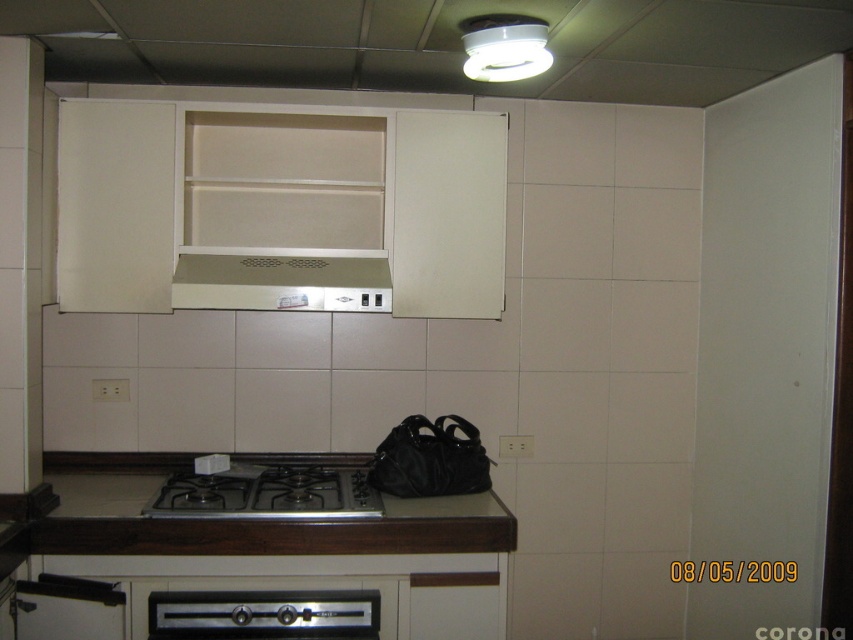
Question: Which object appears farthest from the camera in this image?

Choices:
 (A) satin beige exhaust hood at center
 (B) black matte gas stove at center
 (C) satin silver oven at lower center

Answer: (A)

Question: Does brown wood counter top at center appear over satin beige exhaust hood at center?

Choices:
 (A) yes
 (B) no

Answer: (B)

Question: Considering the real-world distances, which object is farthest from the brown wood counter top at center?

Choices:
 (A) satin beige exhaust hood at center
 (B) satin silver oven at lower center
 (C) black matte gas stove at center

Answer: (A)

Question: Estimate the real-world distances between objects in this image. Which object is farther from the brown wood counter top at center?

Choices:
 (A) satin beige exhaust hood at center
 (B) satin silver oven at lower center
 (C) black matte gas stove at center

Answer: (A)

Question: Is brown wood counter top at center to the left of black matte gas stove at center from the viewer's perspective?

Choices:
 (A) no
 (B) yes

Answer: (B)

Question: Can you confirm if brown wood counter top at center is positioned to the right of satin silver oven at lower center?

Choices:
 (A) yes
 (B) no

Answer: (B)